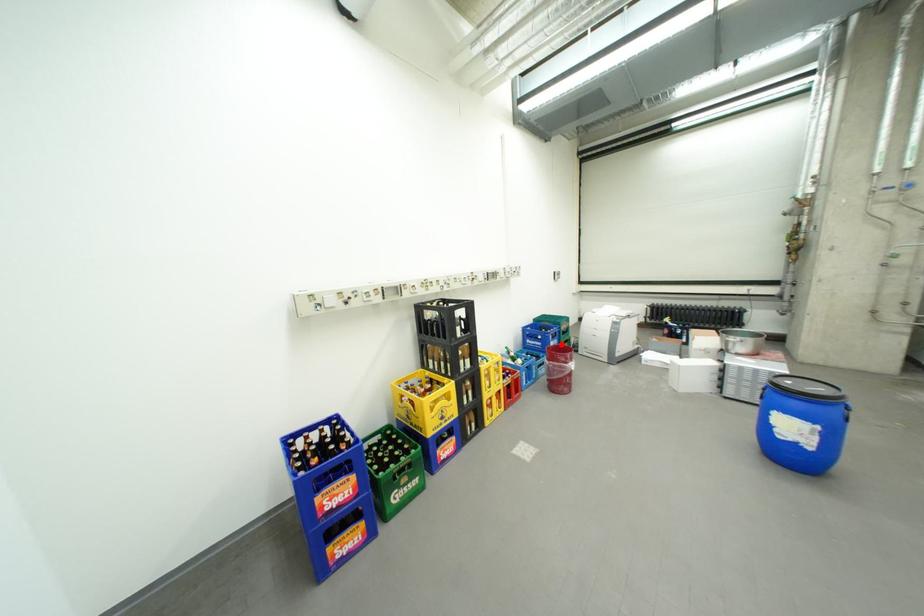
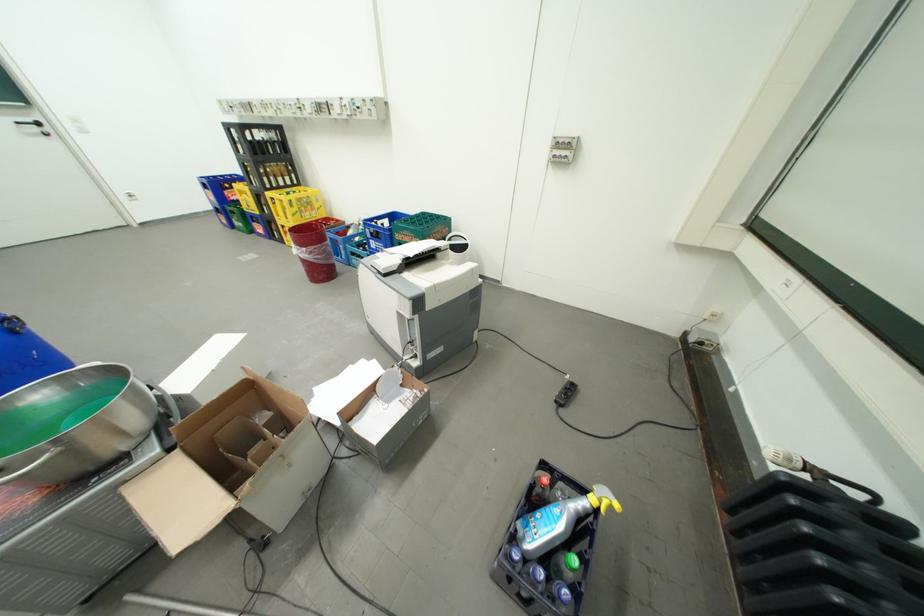
Question: I am providing you with two images of the same scene from different viewpoints. Given a red point in image1, look at the same physical point in image2. Is it:

Choices:
 (A) Closer to the viewpoint
 (B) Farther from the viewpoint

Answer: (B)